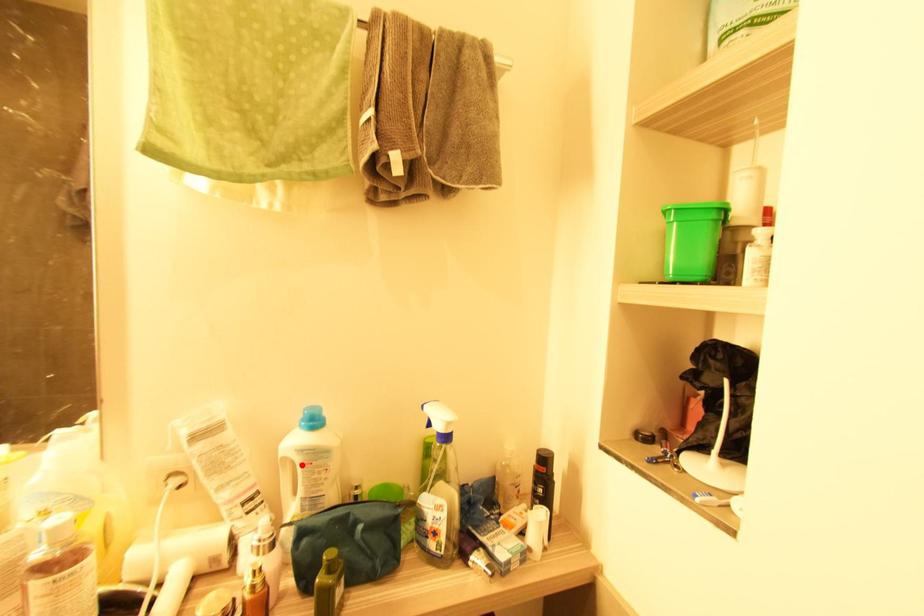
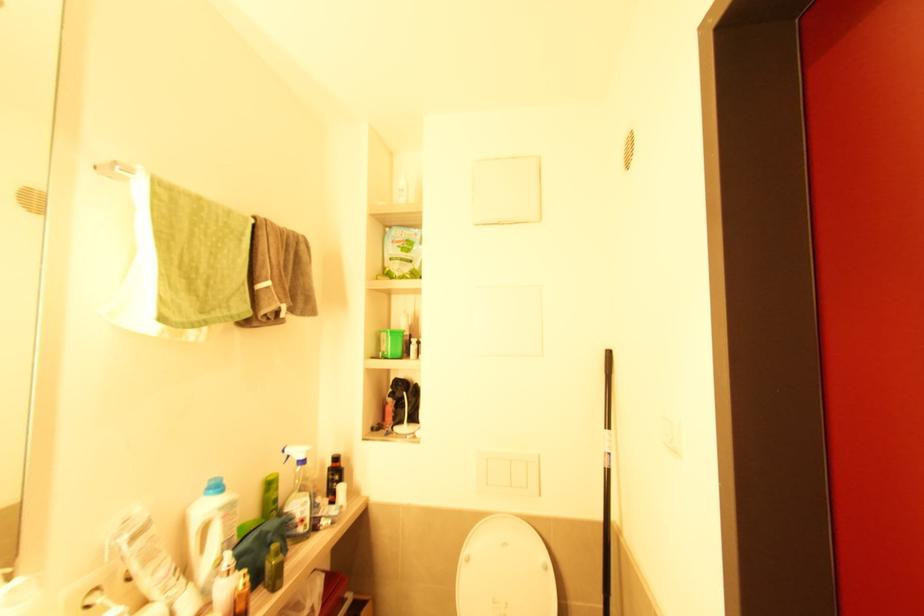
Question: I am providing you with two images of the same scene from different viewpoints. A red point is marked on the first image. Can you still see the location of the red point in image 2?

Choices:
 (A) Yes
 (B) No

Answer: (A)